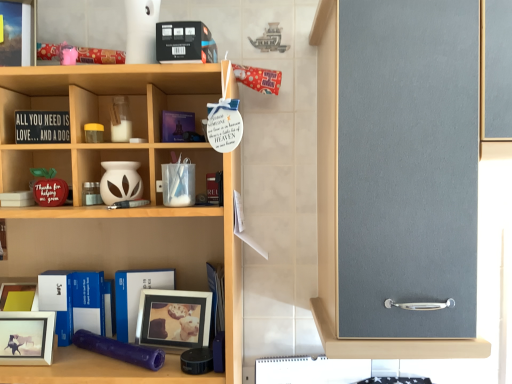
You are a GUI agent. You are given a task and a screenshot of the screen. Output one action in this format:
    pyautogui.click(x=<x>, y=<y>)
    Task: Click on the blank area to the left of black matte book at upper center, the first book positioned from the top
    This screenshot has width=512, height=384.
    Given the screenshot: What is the action you would take?
    pyautogui.click(x=121, y=78)